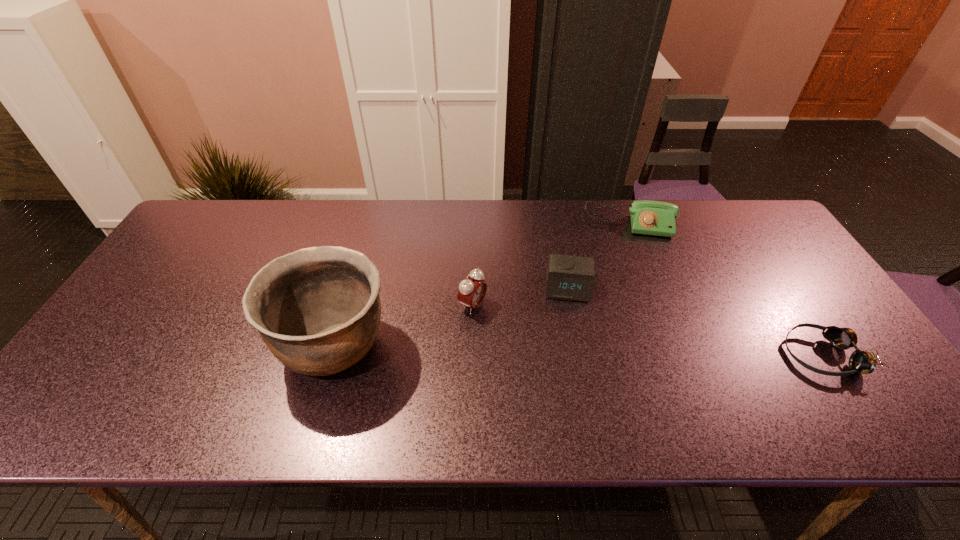
In the image, there is a desktop. Identify the location of vacant space at the left edge. This screenshot has height=540, width=960. (189, 270).

This screenshot has height=540, width=960. Find the location of `vacant space at the right edge`. vacant space at the right edge is located at coordinates (766, 260).

Identify the location of free space at the far left corner of the desktop. (244, 199).

Locate an element on the screen. free spot at the near left corner of the desktop is located at coordinates (136, 368).

Where is `vacant area that lies between the third object from right to left and the goggles`? This screenshot has width=960, height=540. vacant area that lies between the third object from right to left and the goggles is located at coordinates (695, 321).

Locate an element on the screen. This screenshot has height=540, width=960. vacant point located between the pottery and the shorter alarm clock is located at coordinates (452, 316).

Find the location of a particular element. vacant area that lies between the tallest object and the fourth shortest object is located at coordinates (404, 325).

This screenshot has height=540, width=960. Identify the location of free space between the goggles and the third object from right to left. (695, 321).

This screenshot has height=540, width=960. Find the location of `free space between the right alarm clock and the second object from right to left`. free space between the right alarm clock and the second object from right to left is located at coordinates (599, 255).

This screenshot has height=540, width=960. Find the location of `vacant point located between the rightmost object and the tallest object`. vacant point located between the rightmost object and the tallest object is located at coordinates (579, 350).